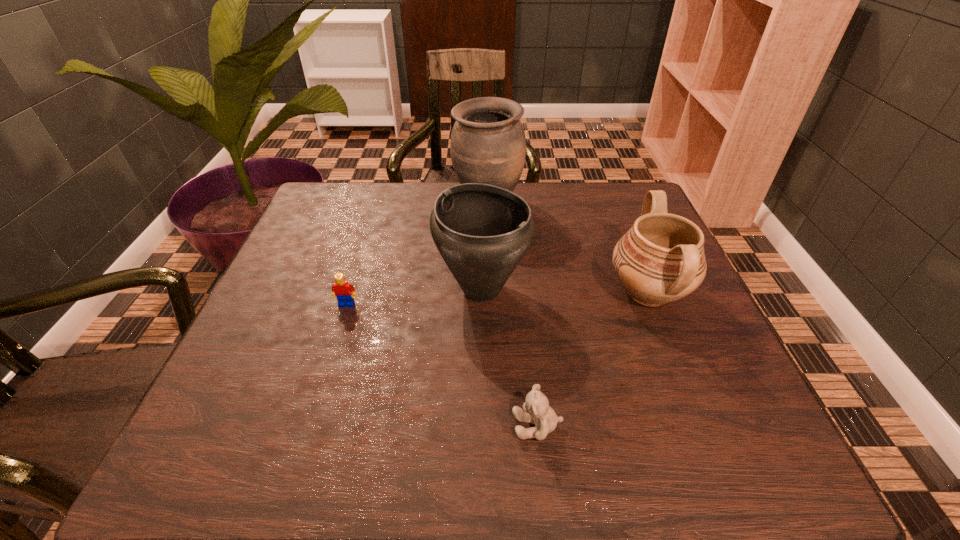
The width and height of the screenshot is (960, 540). In the image, there is a desktop. Identify the location of vacant space at the far left corner. (345, 216).

Where is `blank space at the far right corner`? The height and width of the screenshot is (540, 960). blank space at the far right corner is located at coordinates (617, 185).

Find the location of `free space between the tallest object and the rightmost object`. free space between the tallest object and the rightmost object is located at coordinates (567, 248).

Where is `vacant point located between the Lego and the nearest object`? This screenshot has height=540, width=960. vacant point located between the Lego and the nearest object is located at coordinates (442, 365).

The height and width of the screenshot is (540, 960). I want to click on free space between the leftmost object and the rightmost urn, so click(497, 299).

Locate an element on the screen. The height and width of the screenshot is (540, 960). unoccupied area between the rightmost object and the leftmost object is located at coordinates (497, 299).

Where is `vacant space that's between the teddy bear and the leftmost object`? This screenshot has height=540, width=960. vacant space that's between the teddy bear and the leftmost object is located at coordinates (442, 365).

You are a GUI agent. You are given a task and a screenshot of the screen. Output one action in this format:
    pyautogui.click(x=<x>, y=<y>)
    Task: Click on the vacant space in between the nearest object and the Lego
    Image resolution: width=960 pixels, height=540 pixels.
    Given the screenshot: What is the action you would take?
    pyautogui.click(x=442, y=365)

Where is `object that is the fourth closest to the farthest object`? object that is the fourth closest to the farthest object is located at coordinates (537, 411).

I want to click on the fourth closest object relative to the tallest object, so click(537, 411).